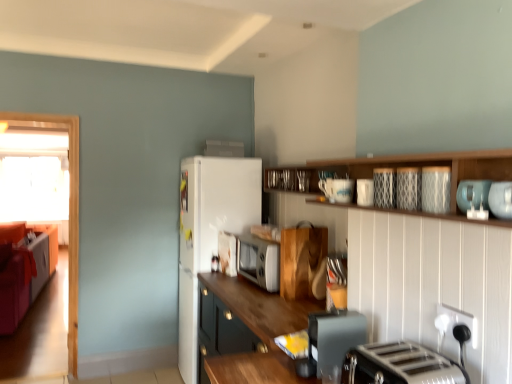
Question: Does white matte refrigerator at upper center, the 1th appliance from the back, lie behind white frosted glass window at left?

Choices:
 (A) yes
 (B) no

Answer: (B)

Question: Is white matte refrigerator at upper center, the 1th appliance from the top, positioned before white frosted glass window at left?

Choices:
 (A) yes
 (B) no

Answer: (A)

Question: Can you confirm if white matte refrigerator at upper center, the 1th appliance from the back, is positioned to the right of white frosted glass window at left?

Choices:
 (A) yes
 (B) no

Answer: (A)

Question: Is white matte refrigerator at upper center, the 1th appliance from the back, taller than white frosted glass window at left?

Choices:
 (A) no
 (B) yes

Answer: (A)

Question: Is white matte refrigerator at upper center, which appears as the 7th appliance when viewed from the front, shorter than white frosted glass window at left?

Choices:
 (A) yes
 (B) no

Answer: (A)

Question: Is porcelain textured mug at upper center, arranged as the fifth appliance when ordered from the bottom, taller or shorter than velvet orange couch at left?

Choices:
 (A) short
 (B) tall

Answer: (A)

Question: Which is correct: porcelain textured mug at upper center, arranged as the fifth appliance when ordered from the bottom, is inside velvet orange couch at left, or outside of it?

Choices:
 (A) outside
 (B) inside

Answer: (A)

Question: Is porcelain textured mug at upper center, arranged as the fifth appliance when ordered from the bottom, in front of or behind velvet orange couch at left in the image?

Choices:
 (A) behind
 (B) front

Answer: (B)

Question: Visually, is porcelain textured mug at upper center, arranged as the fifth appliance when ordered from the bottom, positioned to the left or to the right of velvet orange couch at left?

Choices:
 (A) left
 (B) right

Answer: (B)

Question: Visually, is patterned ceramic plate at upper center, the 3th appliance viewed from the front, positioned to the left or to the right of white frosted glass window at left?

Choices:
 (A) right
 (B) left

Answer: (A)

Question: Considering their positions, is patterned ceramic plate at upper center, placed as the fifth appliance when sorted from back to front, located in front of or behind white frosted glass window at left?

Choices:
 (A) behind
 (B) front

Answer: (B)

Question: Does point (400, 170) appear closer or farther from the camera than point (7, 215)?

Choices:
 (A) closer
 (B) farther

Answer: (A)

Question: In terms of height, does patterned ceramic plate at upper center, which is the 6th appliance in bottom-to-top order, look taller or shorter compared to white frosted glass window at left?

Choices:
 (A) short
 (B) tall

Answer: (A)

Question: Considering their positions, is patterned ceramic plate at upper center, which is the 6th appliance in bottom-to-top order, located in front of or behind wooden cabinet at center, which is counted as the 1th cabinetry, starting from the bottom?

Choices:
 (A) front
 (B) behind

Answer: (A)

Question: Looking at their shapes, would you say patterned ceramic plate at upper center, placed as the fifth appliance when sorted from back to front, is wider or thinner than wooden cabinet at center, which is counted as the 1th cabinetry, starting from the bottom?

Choices:
 (A) thin
 (B) wide

Answer: (A)